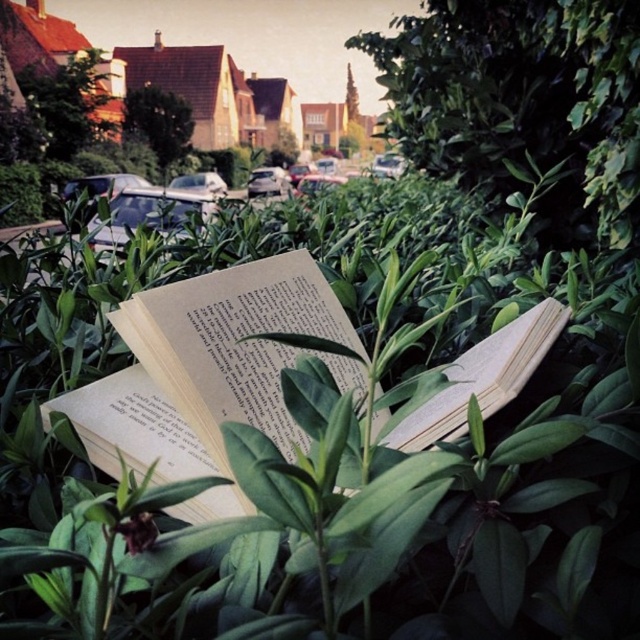
Between beige paper book at center and metallic silver car at center, which one appears on the left side from the viewer's perspective?

metallic silver car at center is more to the left.

Who is shorter, beige paper book at center or metallic silver car at center?

beige paper book at center is shorter.

Image resolution: width=640 pixels, height=640 pixels. What do you see at coordinates (204, 368) in the screenshot?
I see `beige paper book at center` at bounding box center [204, 368].

Identify the location of beige paper book at center. (204, 368).

You are a GUI agent. You are given a task and a screenshot of the screen. Output one action in this format:
    pyautogui.click(x=<x>, y=<y>)
    Task: Click on the metallic silver car at center
    
    Given the screenshot: What is the action you would take?
    pyautogui.click(x=147, y=212)

Which of these two, metallic silver car at center or silver metallic car at center, stands shorter?

silver metallic car at center is shorter.

Is point (177, 228) positioned after point (253, 170)?

No, it is not.

At what (x,y) coordinates should I click in order to perform the action: click on metallic silver car at center. Please return your answer as a coordinate pair (x, y). Looking at the image, I should click on (147, 212).

Between beige paper book at center and silver metallic car at center, which one is positioned higher?

silver metallic car at center

Between beige paper book at center and silver metallic car at center, which one appears on the left side from the viewer's perspective?

Positioned to the left is silver metallic car at center.

I want to click on beige paper book at center, so click(x=204, y=368).